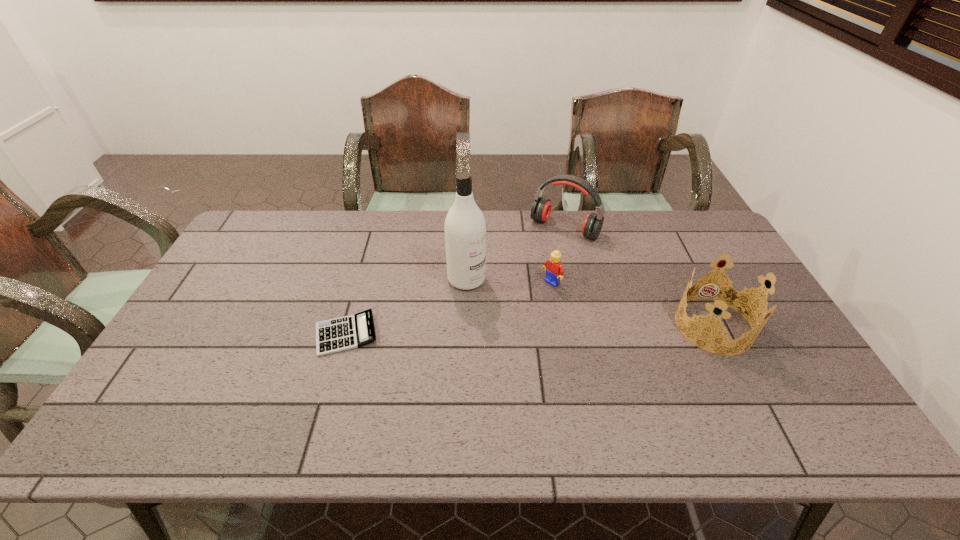
I want to click on the leftmost object, so click(x=349, y=332).

Locate an element on the screen. The width and height of the screenshot is (960, 540). the shortest object is located at coordinates (349, 332).

This screenshot has height=540, width=960. I want to click on crown, so click(x=729, y=298).

The width and height of the screenshot is (960, 540). In order to click on the tallest object in this screenshot , I will do `click(465, 227)`.

Locate an element on the screen. the second object from left to right is located at coordinates (465, 227).

Locate an element on the screen. the farthest object is located at coordinates (541, 208).

Where is `Lego`? Lego is located at coordinates (554, 269).

In order to click on free space located on the right of the calculator in this screenshot , I will do `click(456, 334)`.

In order to click on free space located 0.220m on the left of the rightmost object in this screenshot , I will do `click(597, 326)`.

Locate an element on the screen. free spot located 0.300m on the front-facing side of the shampoo is located at coordinates (551, 352).